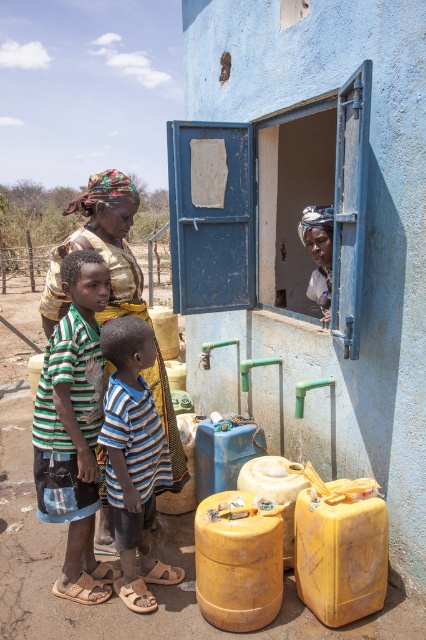
Question: Which point appears closest to the camera in this image?

Choices:
 (A) (127, 390)
 (B) (49, 433)
 (C) (173, 472)

Answer: (A)

Question: Does striped fabric shirt at lower left appear over matte yellow dress at center?

Choices:
 (A) yes
 (B) no

Answer: (B)

Question: Can you confirm if striped cotton shirt at center is bigger than matte yellow dress at center?

Choices:
 (A) yes
 (B) no

Answer: (B)

Question: Is striped cotton shirt at center bigger than matte yellow dress at center?

Choices:
 (A) no
 (B) yes

Answer: (A)

Question: Which object is farther from the camera taking this photo?

Choices:
 (A) striped fabric shirt at lower left
 (B) matte yellow dress at center
 (C) striped cotton shirt at center

Answer: (B)

Question: Based on their relative distances, which object is farther from the striped fabric shirt at lower left?

Choices:
 (A) matte yellow dress at center
 (B) striped cotton shirt at center

Answer: (A)